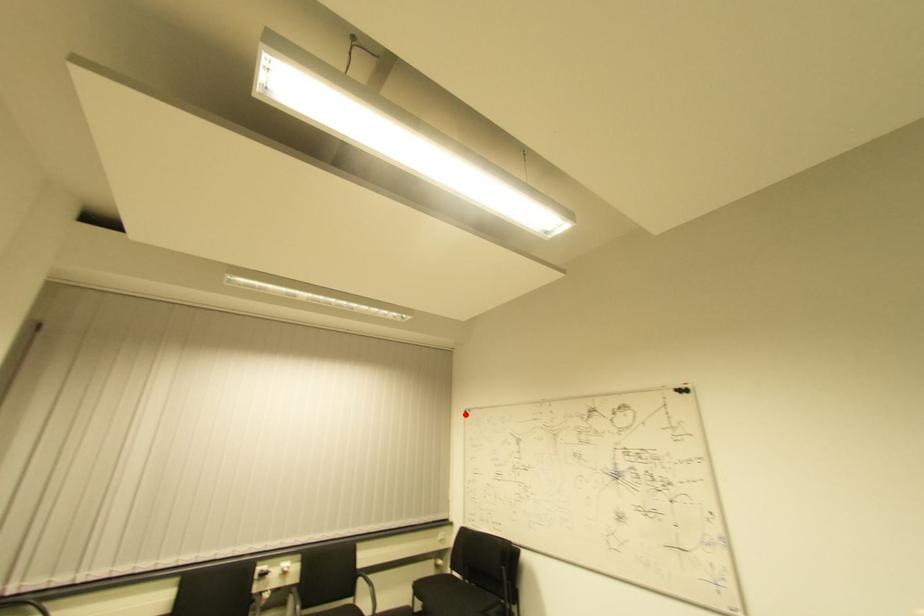
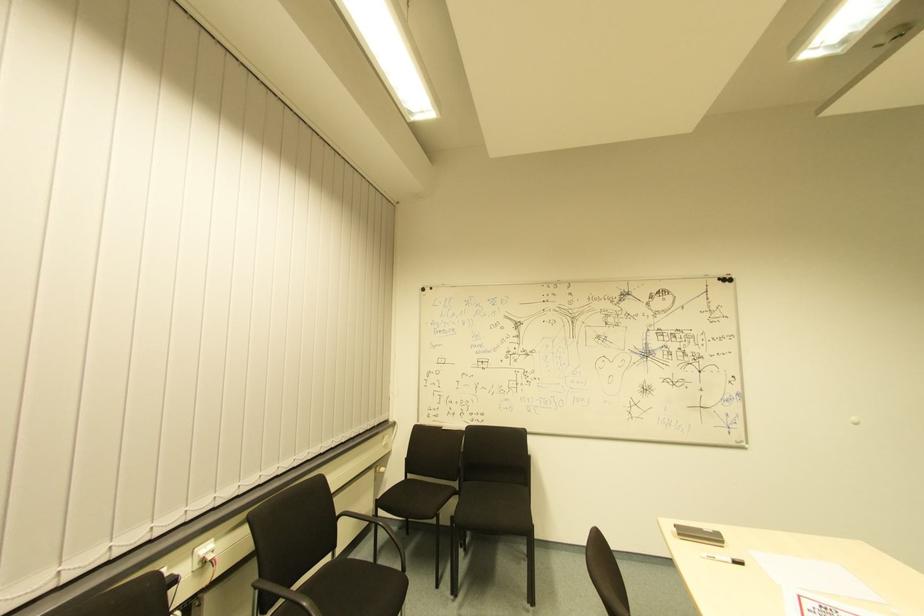
Find the pixel in the second image that matches the highlighted location in the first image.

(427, 293)